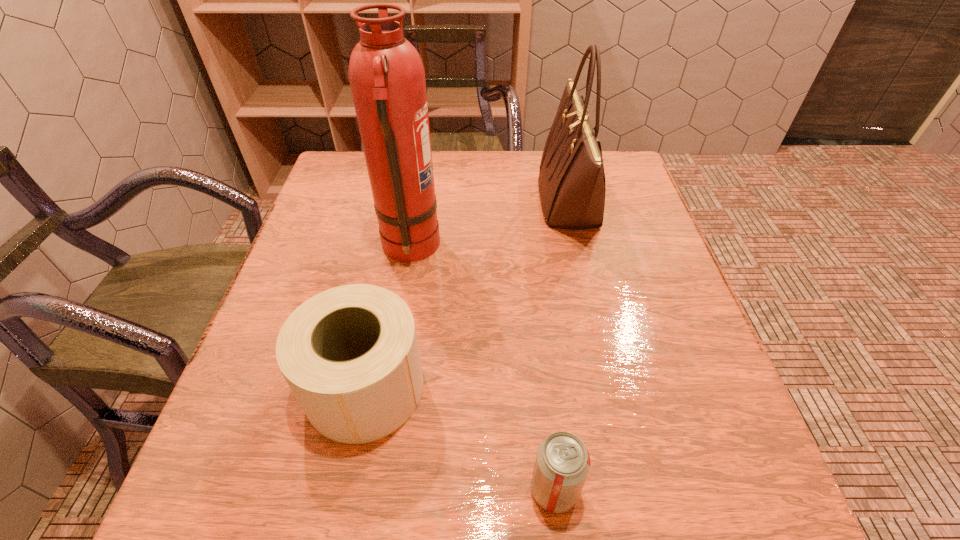
You are a GUI agent. You are given a task and a screenshot of the screen. Output one action in this format:
    pyautogui.click(x=<x>, y=<y>)
    Task: Click on the fire extinguisher
    This screenshot has width=960, height=540.
    Given the screenshot: What is the action you would take?
    pyautogui.click(x=386, y=74)

Identify the location of the rightmost object. (572, 187).

Image resolution: width=960 pixels, height=540 pixels. In order to click on handbag in this screenshot , I will do `click(572, 187)`.

Find the location of a particular element. the second shortest object is located at coordinates [350, 355].

This screenshot has width=960, height=540. In order to click on the second nearest object in this screenshot , I will do coord(350,355).

Where is `the shortest object`? the shortest object is located at coordinates (562, 464).

Image resolution: width=960 pixels, height=540 pixels. In order to click on the second object from right to left in this screenshot , I will do `click(562, 464)`.

Where is `free space located on the label side of the tallest object`? This screenshot has height=540, width=960. free space located on the label side of the tallest object is located at coordinates (595, 248).

In order to click on blank area located 0.330m on the front-facing side of the third shortest object in this screenshot , I will do `click(409, 201)`.

This screenshot has height=540, width=960. I want to click on vacant space located 0.070m on the front-facing side of the third shortest object, so click(x=512, y=201).